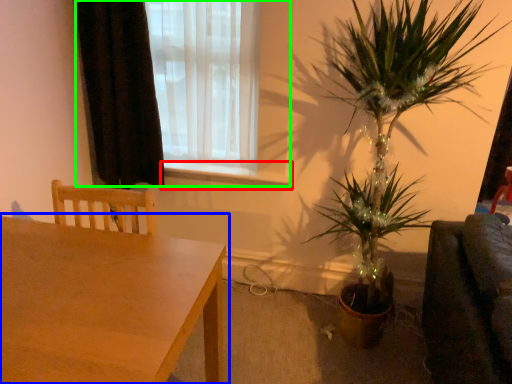
Question: Which object is positioned farthest from window sill (highlighted by a red box)? Select from table (highlighted by a blue box) and window (highlighted by a green box).

Choices:
 (A) table
 (B) window

Answer: (A)